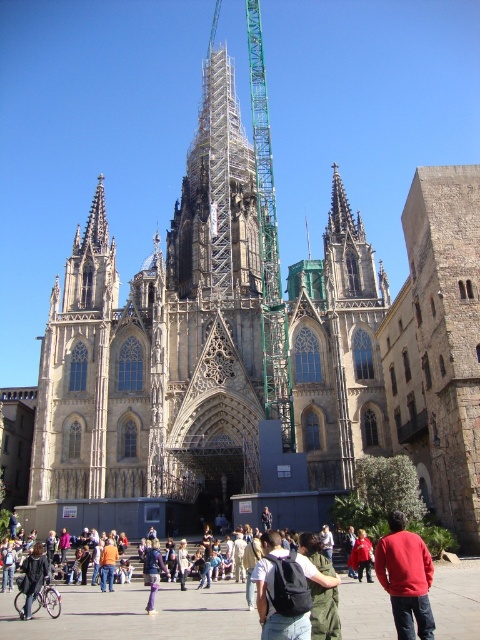
You are a tourist standing in the plaza in front of the cathedral. You see a dark green backpack at center and a denim jacket at lower left. Which item is closer to you?

The dark green backpack at center is closer to you because it is in front of the denim jacket at lower left.

You are a tour guide leading a group through the cathedral plaza. You notice a dark green backpack at center and a denim jacket at lower left. Which item is placed higher up in the scene?

The dark green backpack at center is positioned over the denim jacket at lower left, meaning it is higher up in the scene.